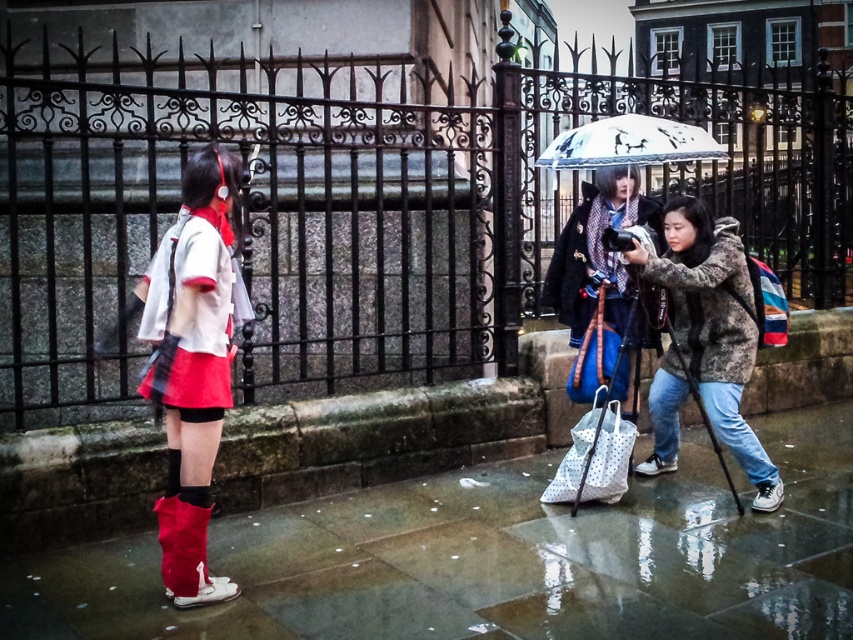
Question: Which point is farther to the camera?

Choices:
 (A) camouflage jacket at lower right
 (B) shiny red boot at lower left

Answer: (A)

Question: Which object is the closest to the camouflage fabric jacket at center?

Choices:
 (A) white glossy umbrella at upper center
 (B) matte red skirt at left

Answer: (A)

Question: Is shiny concrete pavement at lower center further to the viewer compared to shiny red boot at lower left?

Choices:
 (A) no
 (B) yes

Answer: (B)

Question: Does shiny concrete pavement at lower center have a larger size compared to shiny red boot at lower left?

Choices:
 (A) yes
 (B) no

Answer: (A)

Question: Can you confirm if matte red skirt at left is positioned above camouflage jacket at lower right?

Choices:
 (A) no
 (B) yes

Answer: (A)

Question: Which is farther from the camouflage jacket at lower right?

Choices:
 (A) camouflage fabric jacket at center
 (B) matte red skirt at left
 (C) black wrought iron fence at center
 (D) shiny red boot at lower left

Answer: (D)